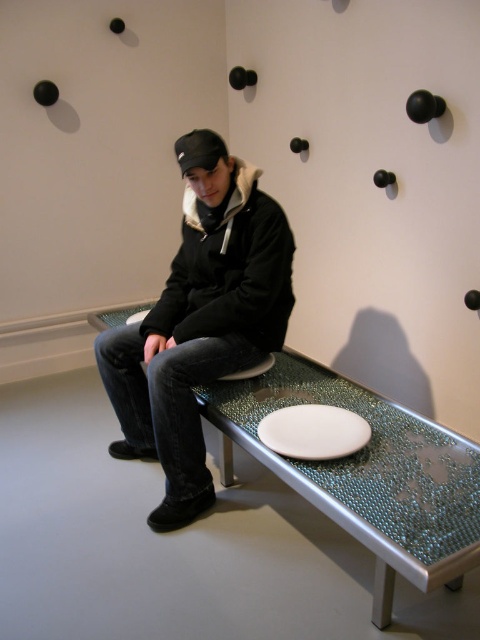
You are standing in the minimalist interior space and want to place a small item on the bench. The bench has two points marked as point (410, 438) and point (289, 416). If you want to place the item closer to the person sitting on the bench, which point should you choose?

Point (410, 438) is in front of point (289, 416). Since the person is sitting on the bench, placing the item at point (410, 438) would be closer to them.

Consider the image. You are a delivery person who needs to place a package on the bench. The package is 16 inches long. Can you safely place the package between the translucent glass bench at center and the white glossy plate at center without touching either?

The distance between the translucent glass bench at center and the white glossy plate at center is 16.30 inches. Since the package is 16 inches long, it can be safely placed between them without touching either object.